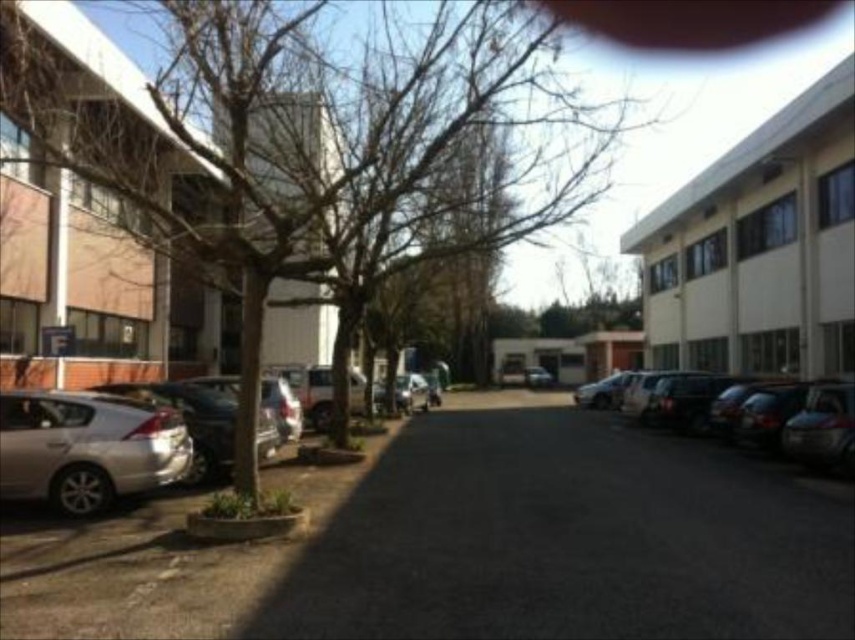
Question: Among these objects, which one is nearest to the camera?

Choices:
 (A) metallic silver car at center
 (B) black asphalt parking lot at center
 (C) satin silver car at lower left

Answer: (B)

Question: Does satin silver car at lower left have a lesser width compared to metallic silver car at right?

Choices:
 (A) yes
 (B) no

Answer: (A)

Question: Is black asphalt parking lot at center above satin silver car at lower left?

Choices:
 (A) no
 (B) yes

Answer: (A)

Question: Considering the real-world distances, which object is farthest from the metallic silver car at center?

Choices:
 (A) brown leafless tree at center
 (B) satin silver car at lower left

Answer: (B)

Question: Based on their relative distances, which object is farther from the metallic silver car at right?

Choices:
 (A) brown leafless tree at center
 (B) black asphalt parking lot at center
 (C) satin silver car at lower left
 (D) metallic silver car at center

Answer: (D)

Question: Is black asphalt parking lot at center thinner than metallic silver car at center?

Choices:
 (A) no
 (B) yes

Answer: (A)